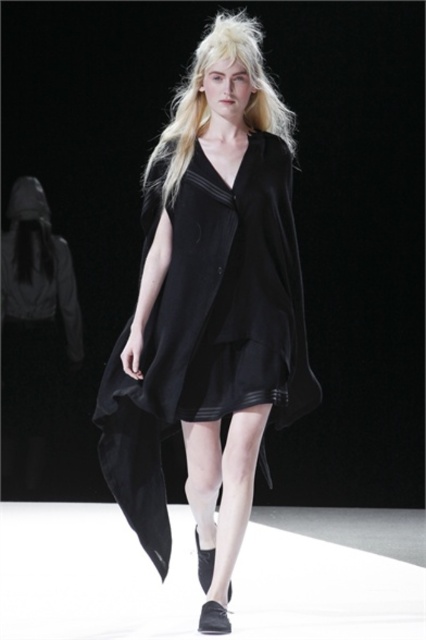
You are a photographer at the runway show and want to capture the model from the front. You notice two points on the model, one at point (x=236, y=193) and another at point (x=267, y=115). Which point is closer to your camera lens?

Point (x=236, y=193) is closer to the viewer than point (x=267, y=115).

Based on the runway scene description, where is the black matte dress at center in relation to the blonde silky hair at center?

The black matte dress at center is to the left of the blonde silky hair at center.